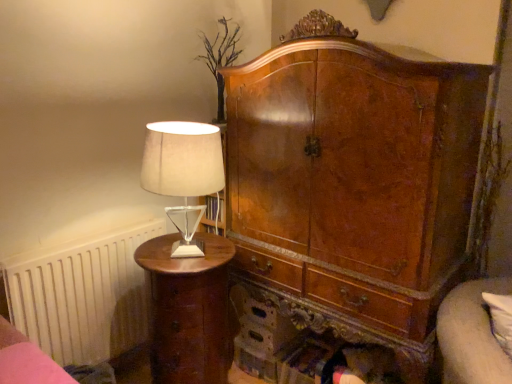
Question: Does wooden bed frame at lower left lie in front of satin beige lampshade at left?

Choices:
 (A) no
 (B) yes

Answer: (B)

Question: Is wooden bed frame at lower left shorter than satin beige lampshade at left?

Choices:
 (A) no
 (B) yes

Answer: (B)

Question: Can satin beige lampshade at left be found inside wooden bed frame at lower left?

Choices:
 (A) no
 (B) yes

Answer: (A)

Question: Is wooden bed frame at lower left positioned far away from satin beige lampshade at left?

Choices:
 (A) no
 (B) yes

Answer: (A)

Question: Can you confirm if wooden bed frame at lower left is taller than satin beige lampshade at left?

Choices:
 (A) no
 (B) yes

Answer: (A)

Question: From the image's perspective, relative to wooden bed frame at lower left, is matte brown nightstand at left above or below?

Choices:
 (A) above
 (B) below

Answer: (B)

Question: From a real-world perspective, relative to wooden bed frame at lower left, is matte brown nightstand at left vertically above or below?

Choices:
 (A) below
 (B) above

Answer: (A)

Question: Visually, is matte brown nightstand at left positioned to the left or to the right of wooden bed frame at lower left?

Choices:
 (A) right
 (B) left

Answer: (A)

Question: Considering their positions, is matte brown nightstand at left located in front of or behind wooden bed frame at lower left?

Choices:
 (A) behind
 (B) front

Answer: (A)

Question: Would you say white matte radiator at left is inside or outside matte brown nightstand at left?

Choices:
 (A) inside
 (B) outside

Answer: (B)

Question: Visually, is white matte radiator at left positioned to the left or to the right of matte brown nightstand at left?

Choices:
 (A) right
 (B) left

Answer: (B)

Question: In terms of size, does white matte radiator at left appear bigger or smaller than matte brown nightstand at left?

Choices:
 (A) small
 (B) big

Answer: (A)

Question: From a real-world perspective, relative to matte brown nightstand at left, is white matte radiator at left vertically above or below?

Choices:
 (A) below
 (B) above

Answer: (B)

Question: Looking at their shapes, would you say satin beige lampshade at left is wider or thinner than wooden bed frame at lower left?

Choices:
 (A) thin
 (B) wide

Answer: (A)

Question: Is satin beige lampshade at left to the left or to the right of wooden bed frame at lower left in the image?

Choices:
 (A) right
 (B) left

Answer: (A)